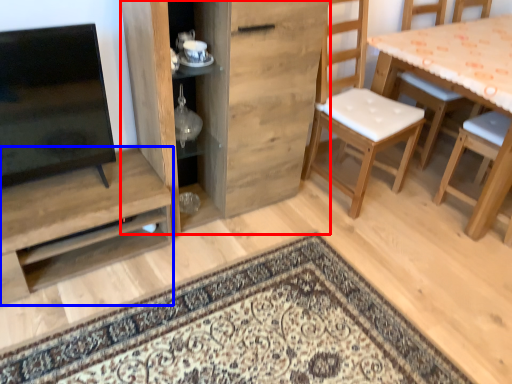
Question: Which object appears farthest to the camera in this image, cabinetry (highlighted by a red box) or shelf (highlighted by a blue box)?

Choices:
 (A) cabinetry
 (B) shelf

Answer: (B)